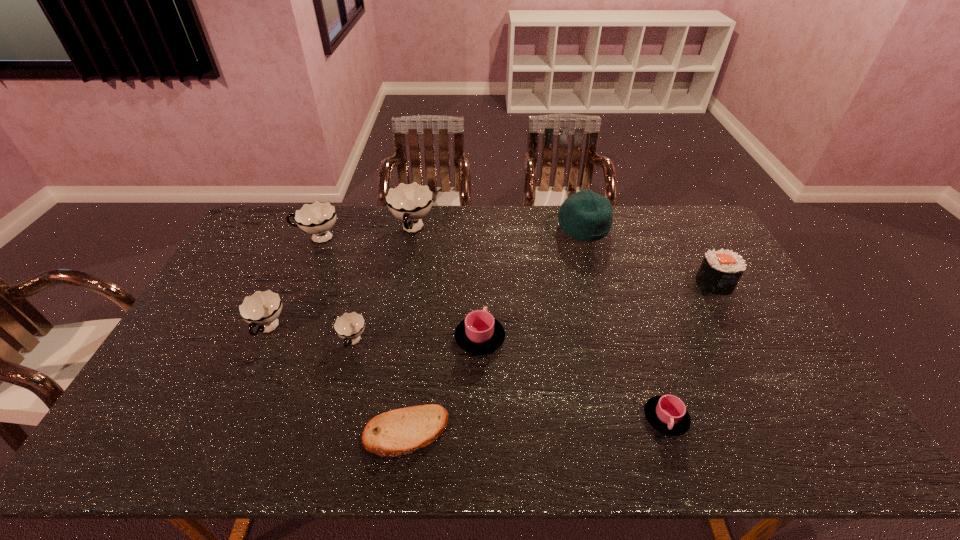
The height and width of the screenshot is (540, 960). What are the coordinates of `free point located 0.260m on the side with the handle of the left pink cup` in the screenshot? It's located at (480, 262).

At what (x,y) coordinates should I click in order to perform the action: click on vacant region located on the side with the handle of the left pink cup. Please return your answer as a coordinate pair (x, y). Looking at the image, I should click on (480, 302).

Image resolution: width=960 pixels, height=540 pixels. Find the location of `vacant space situated 0.130m on the back of the pita bread`. vacant space situated 0.130m on the back of the pita bread is located at coordinates (415, 364).

Find the location of a particular element. The height and width of the screenshot is (540, 960). beanie situated at the far edge is located at coordinates (586, 216).

Locate an element on the screen. The height and width of the screenshot is (540, 960). cup at the near edge is located at coordinates pos(667,414).

What are the coordinates of `pita bread positioned at the near edge` in the screenshot? It's located at (398, 432).

Where is `object present at the right edge`? The image size is (960, 540). object present at the right edge is located at coordinates (720, 271).

Identify the location of free spot at the far edge of the desktop. (523, 205).

Where is `free space at the near edge`? The height and width of the screenshot is (540, 960). free space at the near edge is located at coordinates (610, 444).

Identify the location of blank space at the right edge of the desktop. (767, 340).